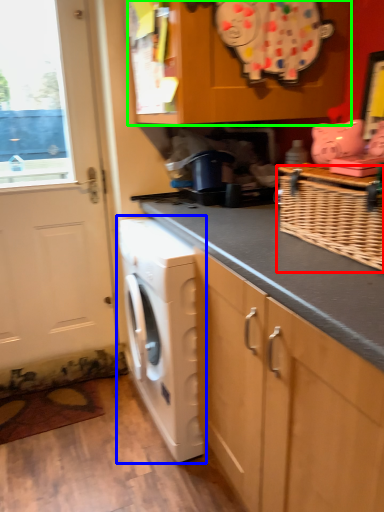
Question: Which is nearer to the basket (highlighted by a red box)? washing machine (highlighted by a blue box) or cabinetry (highlighted by a green box).

Choices:
 (A) washing machine
 (B) cabinetry

Answer: (B)